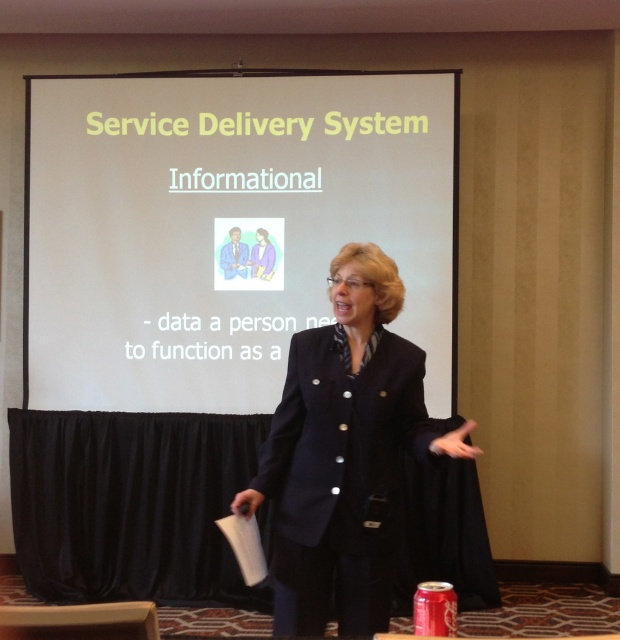
Question: Is white paper at center wider than navy blue blazer at center?

Choices:
 (A) no
 (B) yes

Answer: (B)

Question: Is white paper at center positioned in front of navy blue blazer at center?

Choices:
 (A) no
 (B) yes

Answer: (A)

Question: Among these points, which one is nearest to the camera?

Choices:
 (A) (347, 339)
 (B) (164, 369)

Answer: (A)

Question: Is white paper at center smaller than navy blue blazer at center?

Choices:
 (A) no
 (B) yes

Answer: (A)